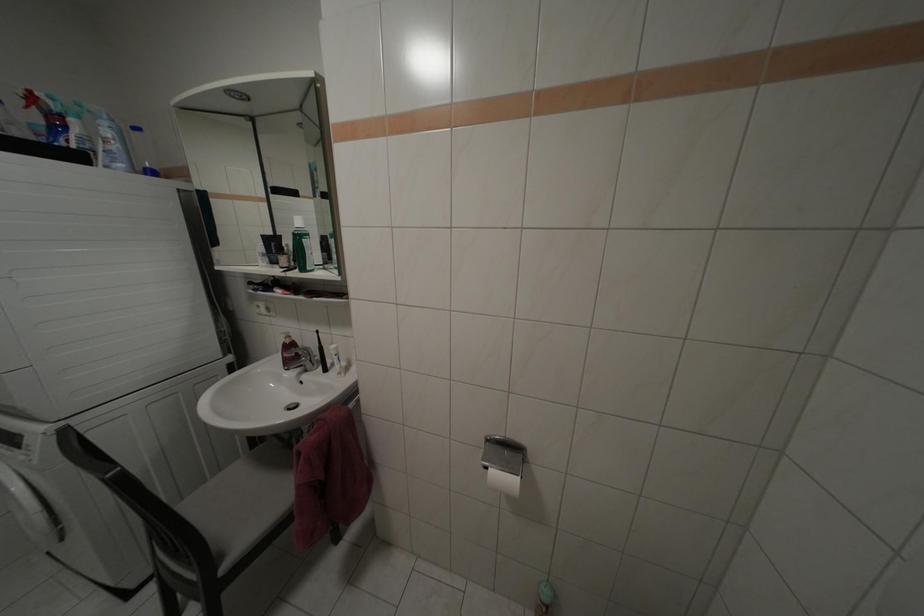
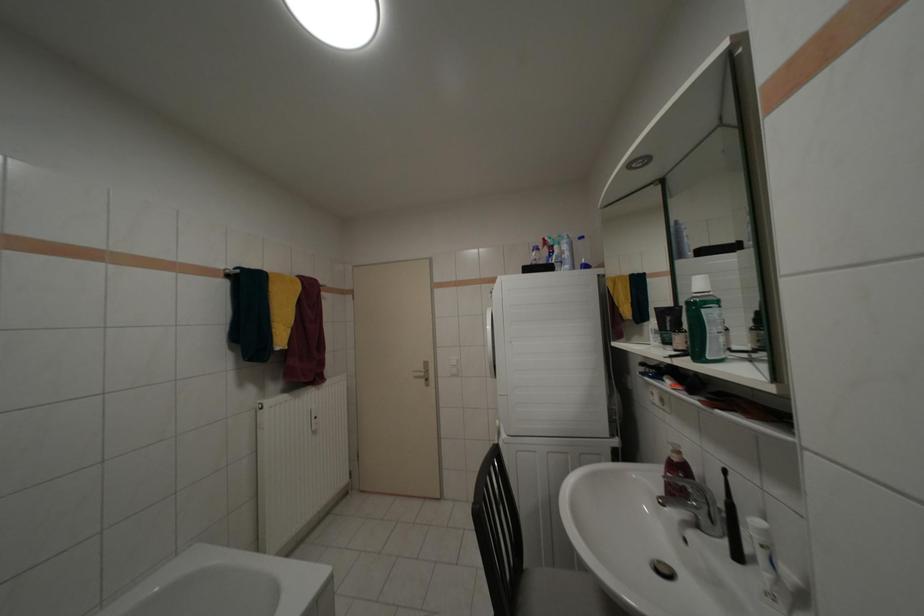
Question: Based on the continuous images, in which direction is the camera rotating? Reply with the corresponding letter.

Choices:
 (A) Left
 (B) Right
 (C) Up
 (D) Down

Answer: (A)